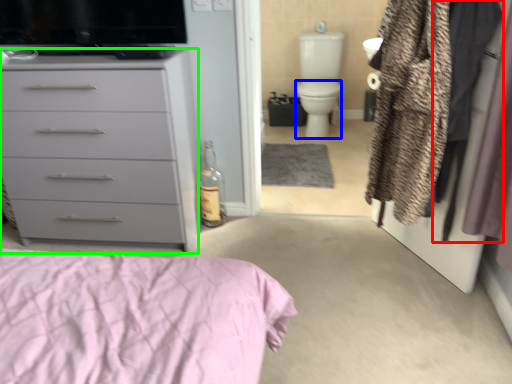
Question: Which object is positioned closest to clothing (highlighted by a red box)? Select from toilet bowl (highlighted by a blue box) and chest of drawers (highlighted by a green box).

Choices:
 (A) toilet bowl
 (B) chest of drawers

Answer: (B)